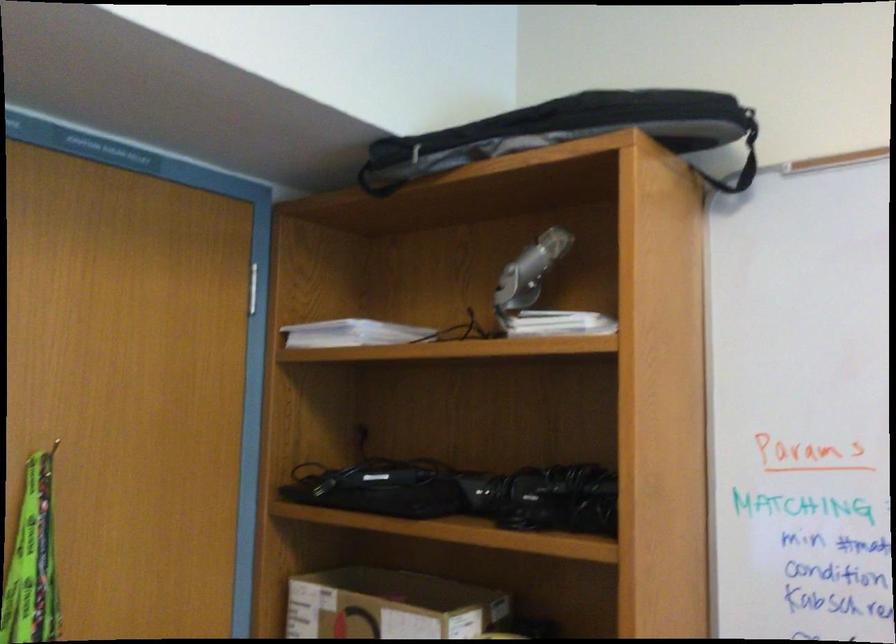
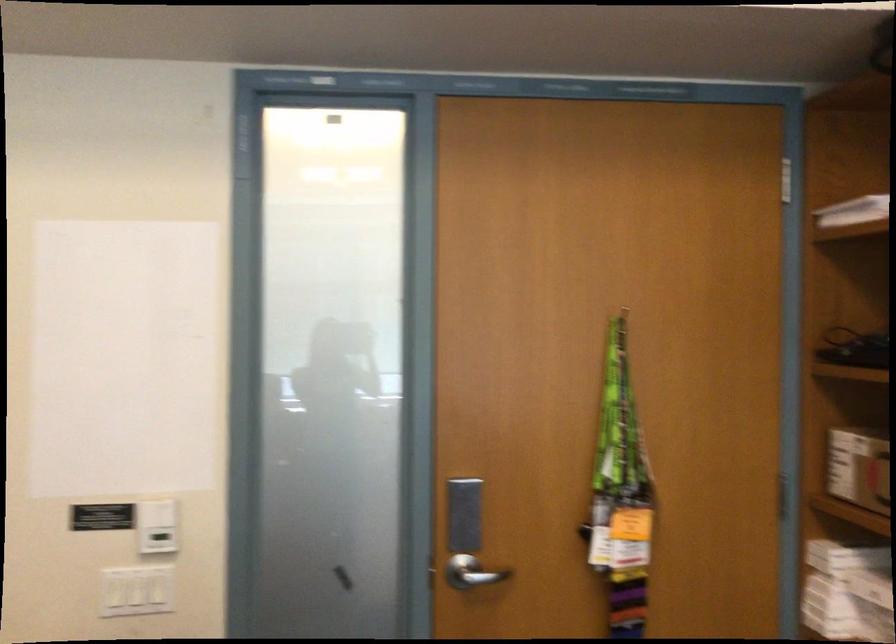
Question: The camera is either moving clockwise (left) or counter-clockwise (right) around the object. The first image is from the beginning of the video and the second image is from the end. Is the camera moving left or right when shooting the video?

Choices:
 (A) Left
 (B) Right

Answer: (B)